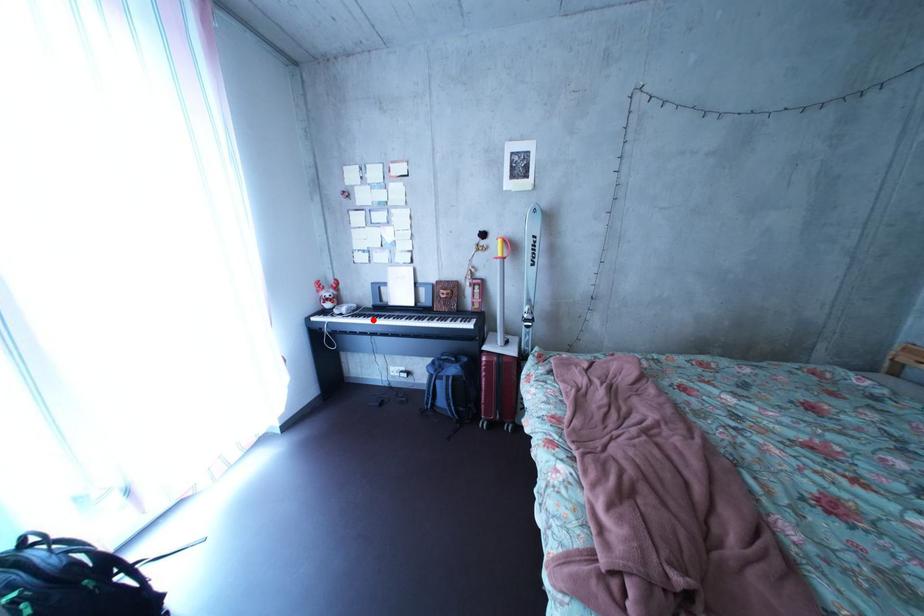
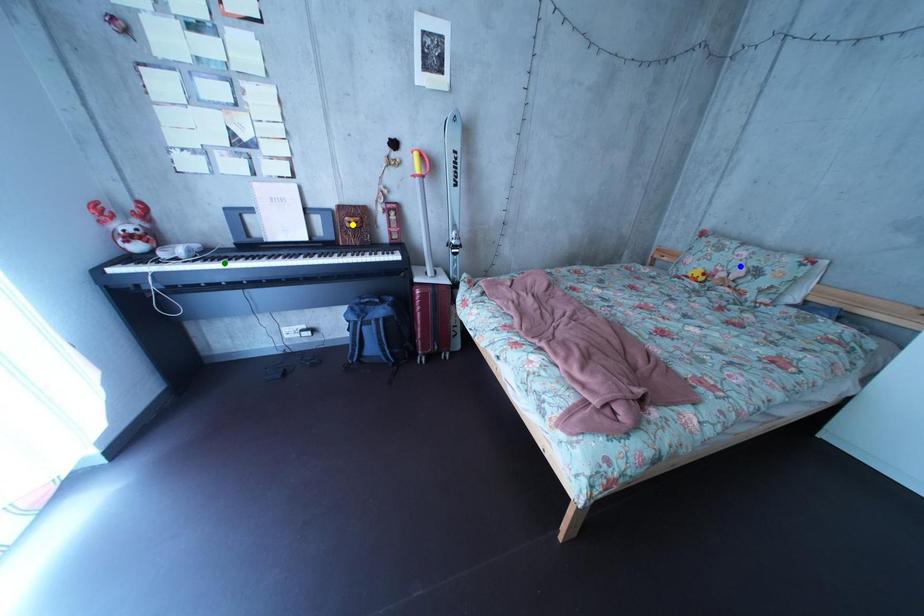
Question: I am providing you with two images of the same scene from different viewpoints. A red point is marked on the first image. You are given multiple points on the second image. Which point in image 2 represents the same 3d spot as the red point in image 1?

Choices:
 (A) green point
 (B) yellow point
 (C) blue point

Answer: (A)